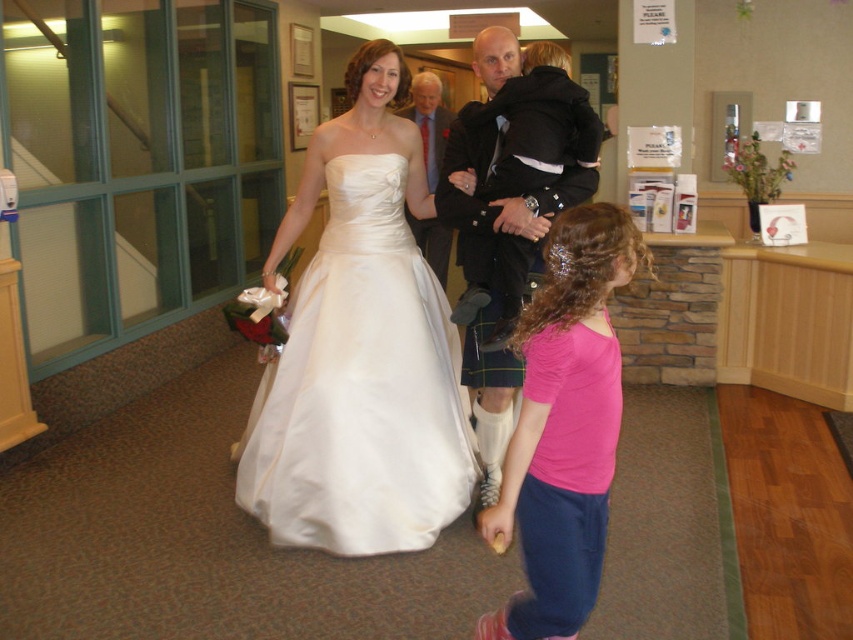
Question: Estimate the real-world distances between objects in this image. Which object is closer to the black kilt at center?

Choices:
 (A) matte white dress at center
 (B) pink satin dress at lower right
 (C) white satin dress at center
 (D) pink fabric shirt at center

Answer: (C)

Question: In this image, where is white satin dress at center located relative to pink satin dress at lower right?

Choices:
 (A) above
 (B) below

Answer: (A)

Question: Observing the image, what is the correct spatial positioning of pink fabric shirt at center in reference to black kilt at center?

Choices:
 (A) left
 (B) right

Answer: (A)

Question: Can you confirm if black kilt at center is positioned below pink satin dress at lower right?

Choices:
 (A) no
 (B) yes

Answer: (A)

Question: Which object is closer to the camera taking this photo?

Choices:
 (A) pink satin dress at lower right
 (B) white satin dress at center
 (C) pink fabric shirt at center

Answer: (C)

Question: Among these objects, which one is farthest from the camera?

Choices:
 (A) matte white dress at center
 (B) black kilt at center

Answer: (A)